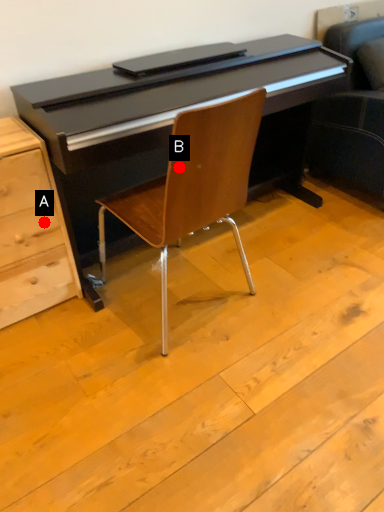
Question: Two points are circled on the image, labeled by A and B beside each circle. Which point is closer to the camera?

Choices:
 (A) A is closer
 (B) B is closer

Answer: (B)